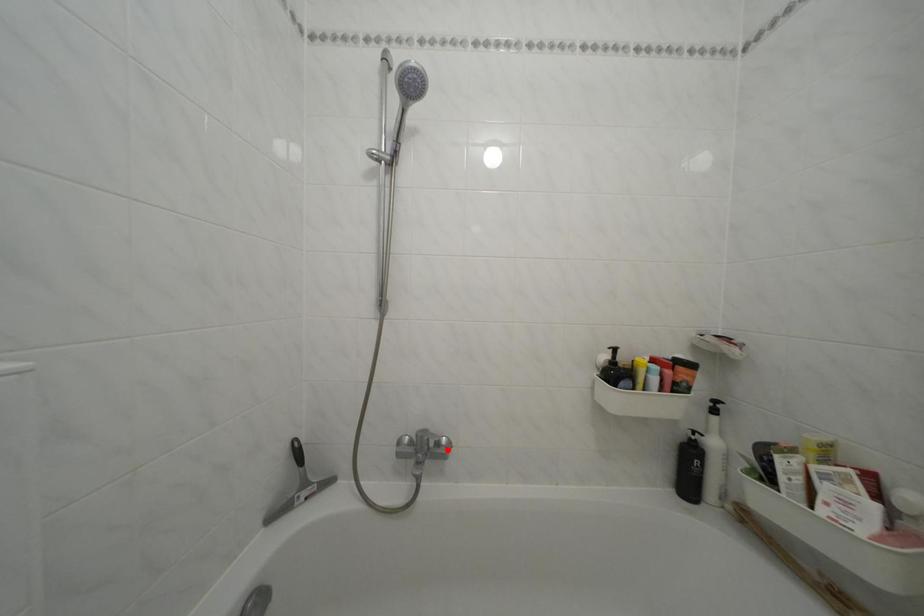
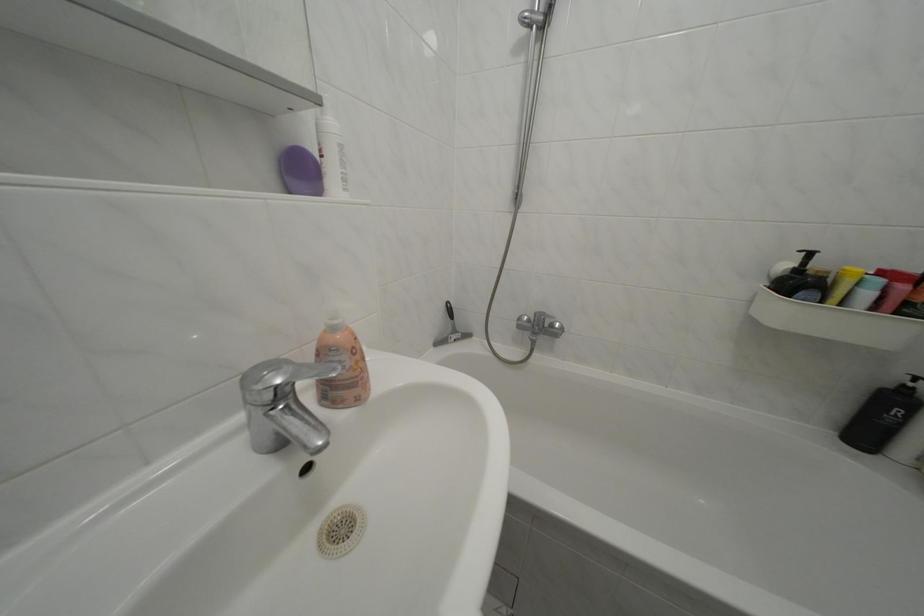
The point at the highlighted location is marked in the first image. Where is the corresponding point in the second image?

(562, 331)